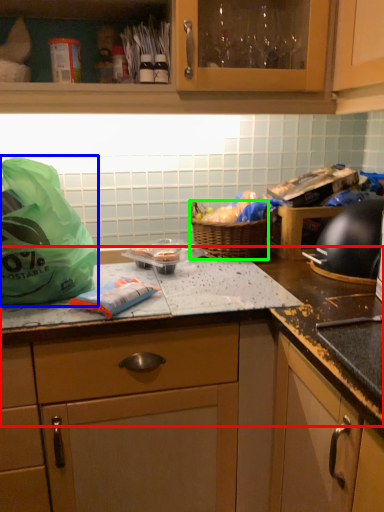
Question: Considering the real-world distances, which object is closest to countertop (highlighted by a red box)? plastic bag (highlighted by a blue box) or picnic basket (highlighted by a green box).

Choices:
 (A) plastic bag
 (B) picnic basket

Answer: (B)